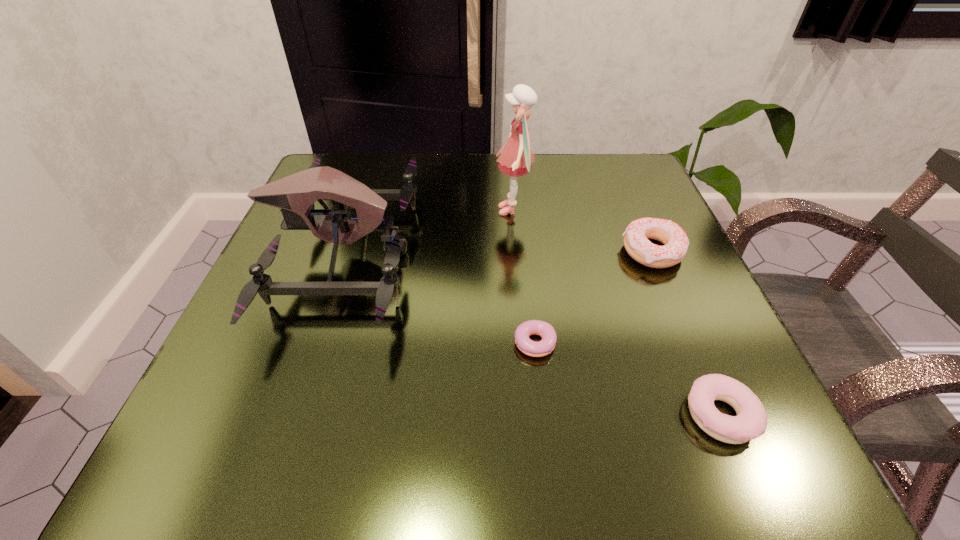
Select which doughnut appears as the second closest to the shortest doughnut. Please provide its 2D coordinates. Your answer should be formatted as a tuple, i.e. [(x, y)], where the tuple contains the x and y coordinates of a point satisfying the conditions above.

[(637, 233)]

Identify the location of free space that satisfies the following two spatial constraints: 1. on the front-facing side of the leftmost object; 2. on the right side of the second shortest doughnut. Image resolution: width=960 pixels, height=540 pixels. (288, 414).

I want to click on vacant region that satisfies the following two spatial constraints: 1. on the back side of the tallest doughnut; 2. on the left side of the nearest object, so click(x=651, y=252).

Locate an element on the screen. The image size is (960, 540). free space that satisfies the following two spatial constraints: 1. on the front-facing side of the doll; 2. on the right side of the fourth tallest object is located at coordinates (532, 414).

Locate an element on the screen. The width and height of the screenshot is (960, 540). free spot that satisfies the following two spatial constraints: 1. on the front side of the farthest doughnut; 2. on the front-facing side of the drone is located at coordinates (653, 253).

This screenshot has height=540, width=960. Find the location of `vacant space that satisfies the following two spatial constraints: 1. on the front-facing side of the nearest doughnut; 2. on the right side of the drone`. vacant space that satisfies the following two spatial constraints: 1. on the front-facing side of the nearest doughnut; 2. on the right side of the drone is located at coordinates (288, 414).

You are a GUI agent. You are given a task and a screenshot of the screen. Output one action in this format:
    pyautogui.click(x=<x>, y=<y>)
    Task: Click on the vacant space that satisfies the following two spatial constraints: 1. on the front-facing side of the drone; 2. on the back side of the second farthest doughnut
    
    Given the screenshot: What is the action you would take?
    pyautogui.click(x=311, y=347)